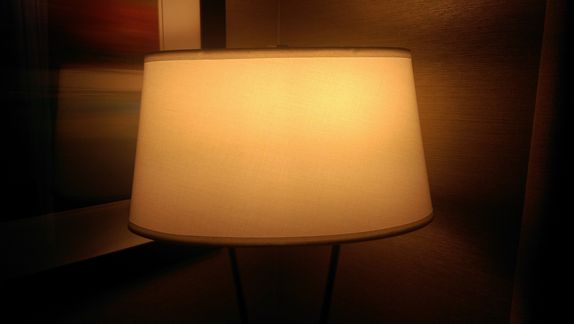
Identify the location of light. The height and width of the screenshot is (324, 574). (472, 153).